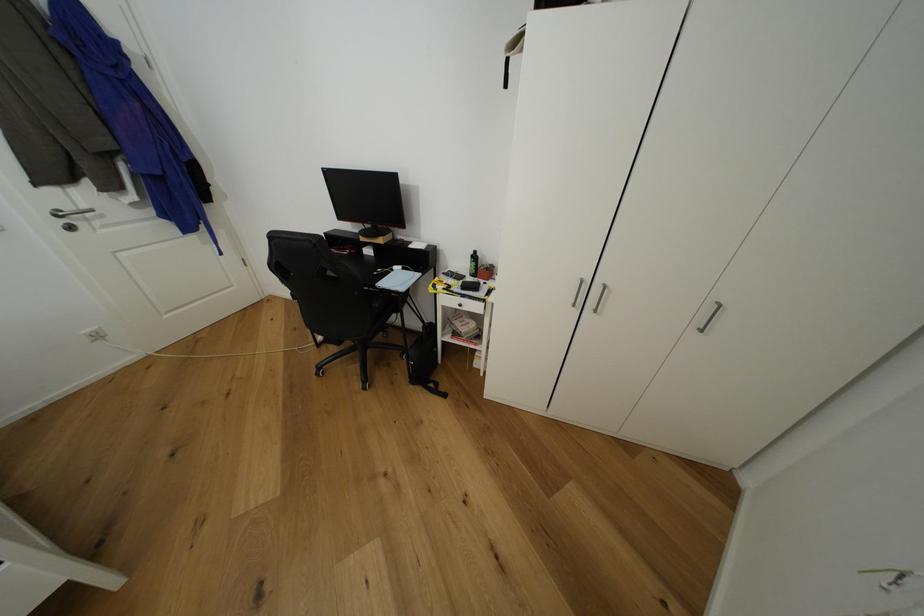
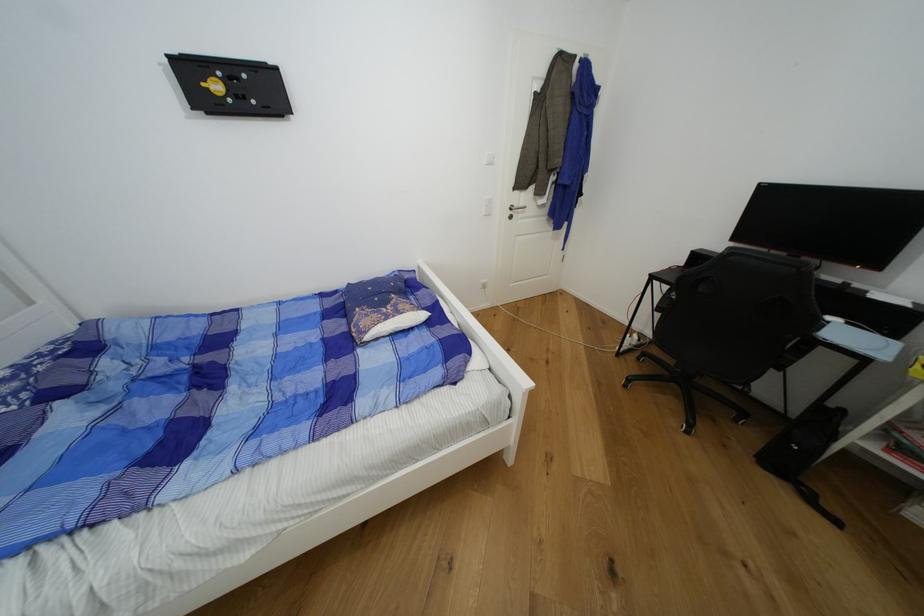
Locate, in the second image, the point that corresponds to (x=74, y=209) in the first image.

(521, 207)